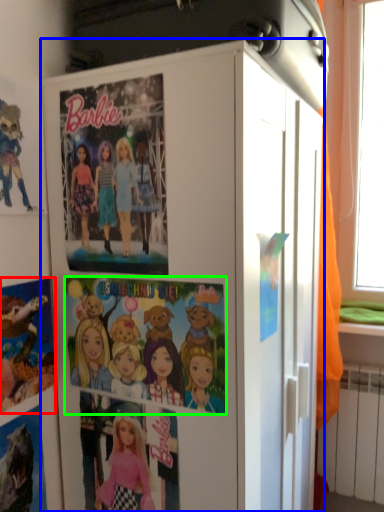
Question: Based on their relative distances, which object is farther from comic book (highlighted by a red box)? Choose from cabinetry (highlighted by a blue box) and comic book (highlighted by a green box).

Choices:
 (A) cabinetry
 (B) comic book

Answer: (A)